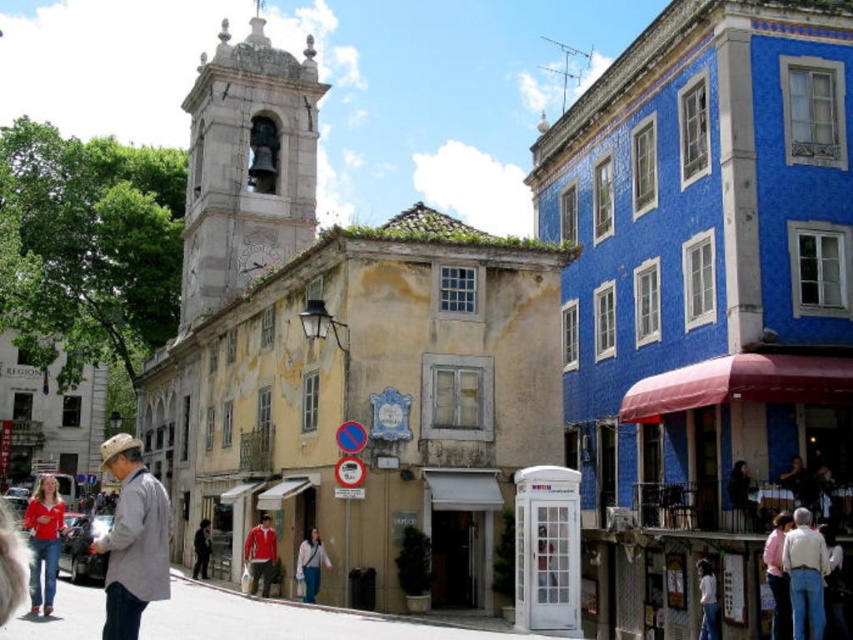
You are a delivery person standing at the entrance of the historic European town. You need to deliver a package to the address located at the base of the tall, narrow tower with a clock face. You see a denim jacket at lower right and a matte red shirt at lower left in the scene. Can you estimate how far apart these two items are from each other to navigate the delivery route?

The denim jacket at lower right and the matte red shirt at lower left are 110.06 feet apart. This distance can help you estimate the path between them while navigating to the tower.

You are a tourist walking along the street and see both the matte red shirt at lower left and the red fabric jacket at center. Which one is positioned more to the left side of the street?

The matte red shirt at lower left is positioned more to the left side of the street than the red fabric jacket at center.

You are a passerby on the street and see both the gray cotton jacket at lower left and the red fabric jacket at center. Which jacket is positioned closer to the left side of the street?

The gray cotton jacket at lower left is positioned closer to the left side of the street than the red fabric jacket at center.